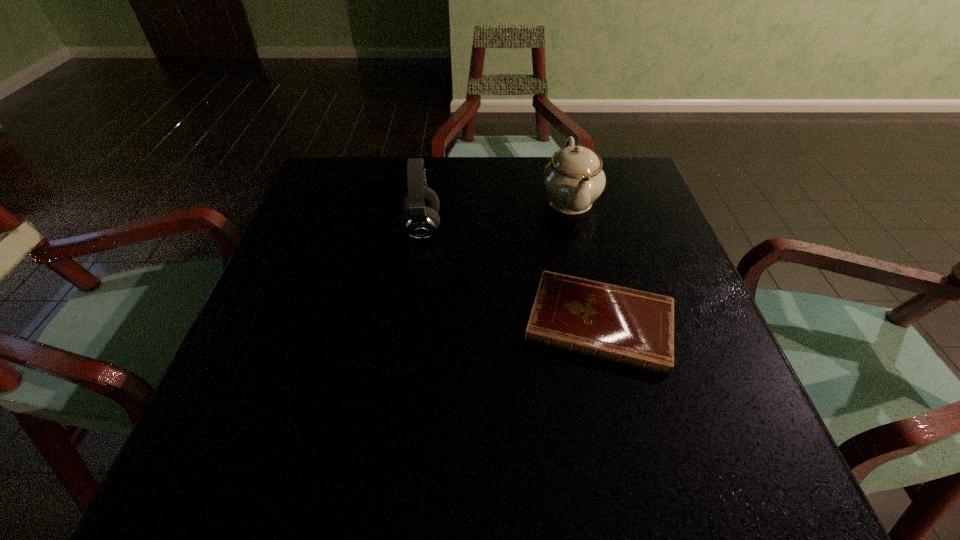
Where is `notebook situated at the right edge`? notebook situated at the right edge is located at coordinates 633,327.

At what (x,y) coordinates should I click in order to perform the action: click on object at the far right corner. Please return your answer as a coordinate pair (x, y). Image resolution: width=960 pixels, height=540 pixels. Looking at the image, I should click on (574, 179).

Locate an element on the screen. The width and height of the screenshot is (960, 540). vacant point at the far edge is located at coordinates (495, 157).

At what (x,y) coordinates should I click in order to perform the action: click on vacant region at the near edge. Please return your answer as a coordinate pair (x, y). Looking at the image, I should click on (583, 431).

In the image, there is a desktop. Identify the location of vacant space at the left edge. (323, 268).

I want to click on free space at the right edge, so click(627, 221).

Locate an element on the screen. The image size is (960, 540). vacant space at the far left corner is located at coordinates (315, 195).

What are the coordinates of `free space at the far right corner` in the screenshot? It's located at (636, 205).

Locate an element on the screen. The image size is (960, 540). free spot at the near right corner of the desktop is located at coordinates (672, 475).

At what (x,y) coordinates should I click in order to perform the action: click on vacant area between the notebook and the chinaware. Please return your answer as a coordinate pair (x, y). Image resolution: width=960 pixels, height=540 pixels. Looking at the image, I should click on (585, 261).